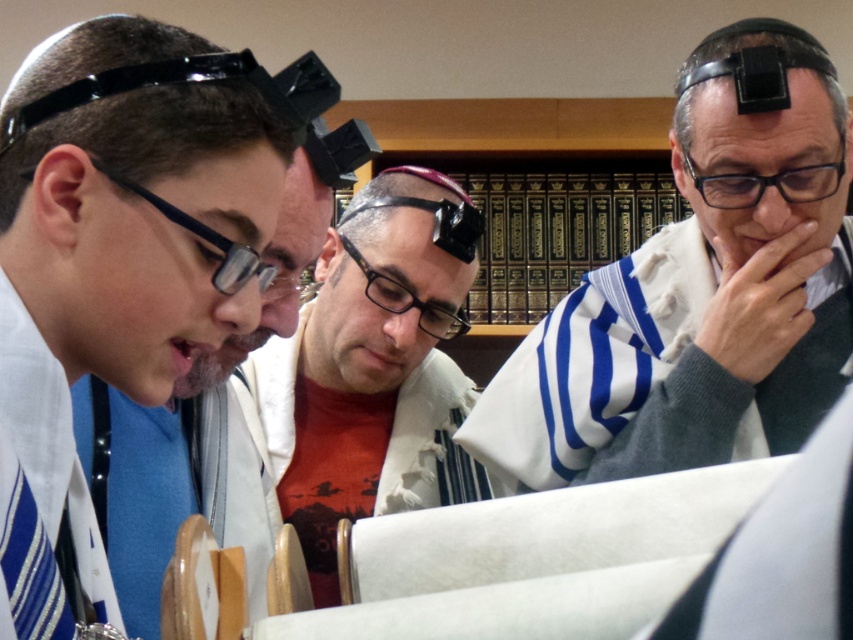
Consider the image. You are a photographer trying to capture a closeup shot of the black plastic glasses at upper right without including the white striped shawl at center in the frame. Given their proximity, do you think this is possible?

The white striped shawl at center is only 14.63 inches away from the black plastic glasses at upper right, so it might be challenging to capture a closeup of the black plastic glasses at upper right without including the white striped shawl at center in the frame due to their close proximity.

You are a photographer standing at the entrance of the library. You want to take a picture of the white textured kippah at left. Where should you position your camera to capture it in the frame?

The white textured kippah at left is located at the 2D coordinates point (126,250), so position the camera to aim at that point to capture it in the frame.

You are a photographer trying to capture a closeup of the black plastic glasses at upper right without including the white striped shawl at center in the frame. Given their relative positions and sizes, is this possible?

The white striped shawl at center is taller than the black plastic glasses at upper right. Since the shawl is taller, it might block the view of the glasses if they are positioned behind it. However, without knowing their exact horizontal positioning, it is uncertain if they can be framed separately.